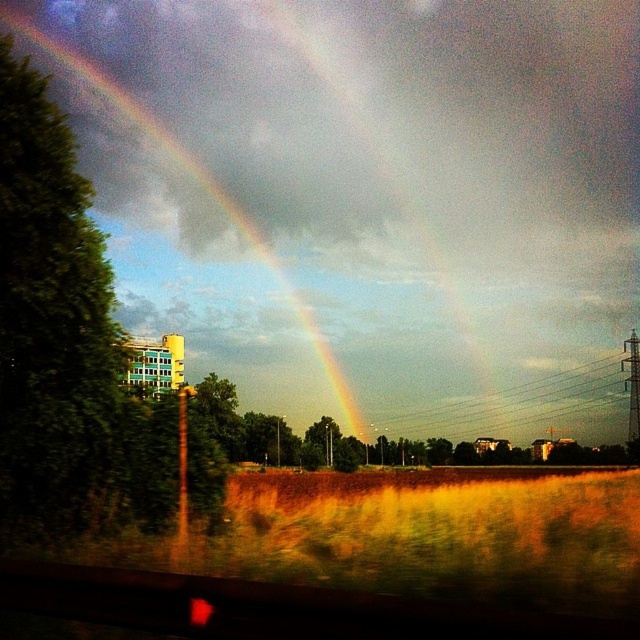
From the picture: Can you confirm if rainbow at left is shorter than metallic wire at center?

Incorrect, rainbow at left's height does not fall short of metallic wire at center's.

Can you confirm if rainbow at left is positioned to the left of metallic wire at center?

Indeed, rainbow at left is positioned on the left side of metallic wire at center.

Which is in front, point (84, 72) or point (556, 387)?

Point (556, 387)

Where is `rainbow at left`? The image size is (640, 640). rainbow at left is located at coordinates click(x=205, y=193).